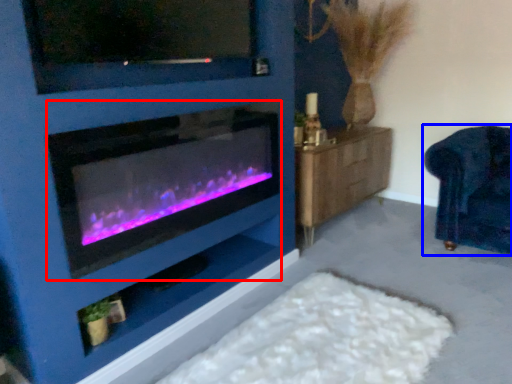
Question: Among these objects, which one is nearest to the camera, wood burning stove (highlighted by a red box) or furniture (highlighted by a blue box)?

Choices:
 (A) wood burning stove
 (B) furniture

Answer: (A)